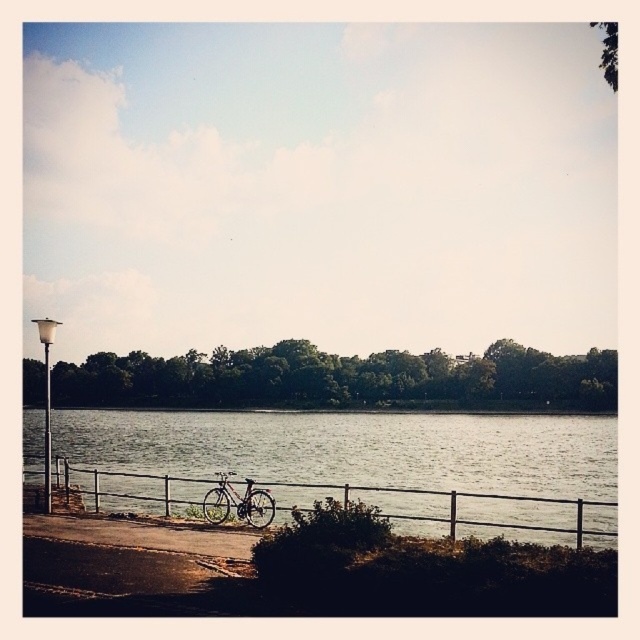
Question: Can you confirm if metallic silver fence at lower center is positioned below shiny silver bicycle at lower center?

Choices:
 (A) yes
 (B) no

Answer: (A)

Question: Is metallic silver fence at lower center bigger than shiny silver bicycle at lower center?

Choices:
 (A) yes
 (B) no

Answer: (A)

Question: Which object is positioned closest to the white glossy lamp post at left?

Choices:
 (A) shiny silver bicycle at lower center
 (B) metallic silver fence at lower center

Answer: (B)

Question: Which point is closer to the camera?

Choices:
 (A) coord(564,529)
 (B) coord(45,506)

Answer: (A)

Question: Is the position of shiny silver bicycle at lower center more distant than that of white glossy lamp post at left?

Choices:
 (A) yes
 (B) no

Answer: (B)

Question: Among these objects, which one is farthest from the camera?

Choices:
 (A) white glossy lamp post at left
 (B) shiny silver bicycle at lower center

Answer: (A)